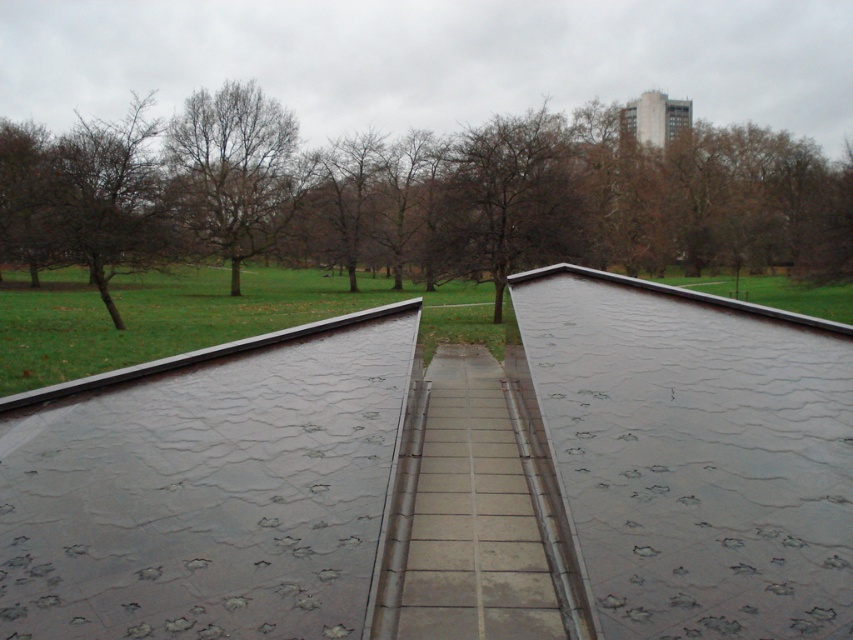
Question: Can you confirm if glossy concrete ramp at center is positioned to the left of gray concrete path at center?

Choices:
 (A) no
 (B) yes

Answer: (B)

Question: Which point appears closest to the camera in this image?

Choices:
 (A) (775, 628)
 (B) (421, 515)
 (C) (201, 93)

Answer: (A)

Question: Can you confirm if gray concrete path at center is thinner than bare branches at upper left?

Choices:
 (A) no
 (B) yes

Answer: (B)

Question: Is brown leafless tree at upper left to the right of glossy concrete ramp at center from the viewer's perspective?

Choices:
 (A) yes
 (B) no

Answer: (A)

Question: Which object is closer to the camera taking this photo?

Choices:
 (A) gray concrete path at center
 (B) bare branches at upper left
 (C) brown matte tree at center

Answer: (A)

Question: Which point is closer to the camera taking this photo?

Choices:
 (A) (401, 278)
 (B) (433, 416)
 (C) (9, 401)

Answer: (C)